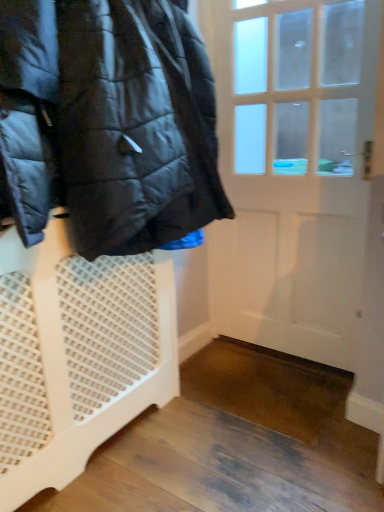
Question: From a real-world perspective, is white mesh laundry basket at left on glossy black jacket at left?

Choices:
 (A) yes
 (B) no

Answer: (B)

Question: From a real-world perspective, is white mesh laundry basket at left below glossy black jacket at left?

Choices:
 (A) no
 (B) yes

Answer: (B)

Question: Could you tell me if white mesh laundry basket at left is facing glossy black jacket at left?

Choices:
 (A) no
 (B) yes

Answer: (A)

Question: Is white mesh laundry basket at left not inside glossy black jacket at left?

Choices:
 (A) no
 (B) yes

Answer: (B)

Question: Is white mesh laundry basket at left far from glossy black jacket at left?

Choices:
 (A) no
 (B) yes

Answer: (A)

Question: Is white mesh laundry basket at left inside or outside of glossy black jacket at left?

Choices:
 (A) inside
 (B) outside

Answer: (B)

Question: In the image, is white mesh laundry basket at left positioned in front of or behind glossy black jacket at left?

Choices:
 (A) front
 (B) behind

Answer: (B)

Question: Considering the positions of white mesh laundry basket at left and glossy black jacket at left in the image, is white mesh laundry basket at left wider or thinner than glossy black jacket at left?

Choices:
 (A) thin
 (B) wide

Answer: (A)

Question: Is point (130, 272) closer or farther from the camera than point (39, 75)?

Choices:
 (A) farther
 (B) closer

Answer: (A)

Question: Is white wooden door at center in front of or behind white mesh laundry basket at left in the image?

Choices:
 (A) front
 (B) behind

Answer: (B)

Question: Is white wooden door at center inside the boundaries of white mesh laundry basket at left, or outside?

Choices:
 (A) outside
 (B) inside

Answer: (A)

Question: From a real-world perspective, relative to white mesh laundry basket at left, is white wooden door at center vertically above or below?

Choices:
 (A) below
 (B) above

Answer: (B)

Question: From their relative heights in the image, would you say white wooden door at center is taller or shorter than white mesh laundry basket at left?

Choices:
 (A) tall
 (B) short

Answer: (A)

Question: Based on their sizes in the image, would you say white mesh laundry basket at left is bigger or smaller than white wooden door at center?

Choices:
 (A) big
 (B) small

Answer: (A)

Question: Considering the positions of white mesh laundry basket at left and white wooden door at center in the image, is white mesh laundry basket at left wider or thinner than white wooden door at center?

Choices:
 (A) thin
 (B) wide

Answer: (B)